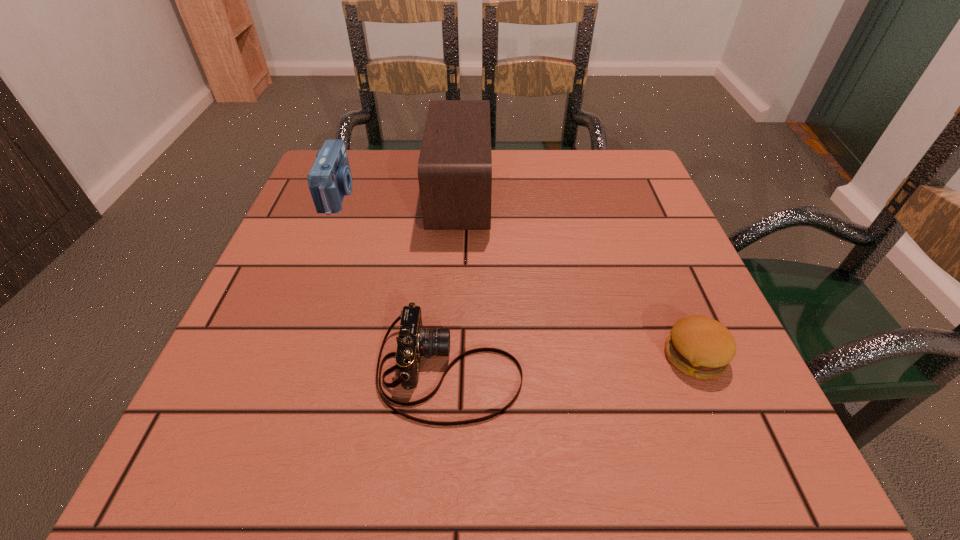
At what (x,y) coordinates should I click in order to perform the action: click on vacant region at the far left corner of the desktop. Please return your answer as a coordinate pair (x, y). The width and height of the screenshot is (960, 540). Looking at the image, I should click on (365, 190).

You are a GUI agent. You are given a task and a screenshot of the screen. Output one action in this format:
    pyautogui.click(x=<x>, y=<y>)
    Task: Click on the free space at the near left corner of the desktop
    
    Given the screenshot: What is the action you would take?
    pos(278,429)

Where is `vacant space at the far right corner of the desktop`? This screenshot has height=540, width=960. vacant space at the far right corner of the desktop is located at coordinates (584, 161).

Where is `free region at the near right corner of the desktop`? This screenshot has height=540, width=960. free region at the near right corner of the desktop is located at coordinates (701, 453).

Where is `free spot between the rightmost object and the radio receiver`? free spot between the rightmost object and the radio receiver is located at coordinates (577, 276).

I want to click on empty space that is in between the farther camera and the shorter camera, so [394, 282].

This screenshot has width=960, height=540. Identify the location of vacant area that lies between the radio receiver and the rightmost object. (577, 276).

I want to click on free space between the hamburger and the shorter camera, so click(572, 363).

Identify the location of free space between the radio receiver and the rightmost object. The width and height of the screenshot is (960, 540). (577, 276).

In order to click on empty space that is in between the nearer camera and the leftmost object in this screenshot , I will do `click(394, 282)`.